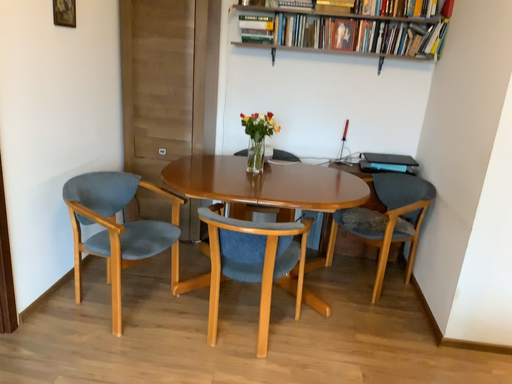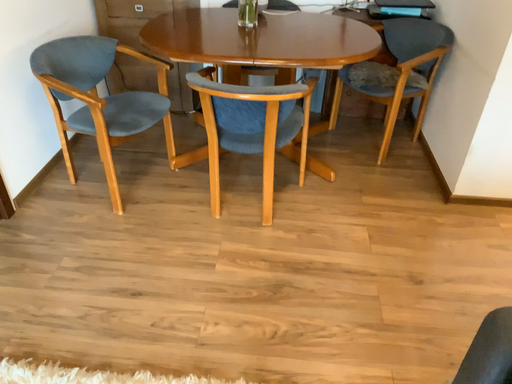
Question: How did the camera likely rotate when shooting the video?

Choices:
 (A) rotated upward
 (B) rotated downward

Answer: (B)